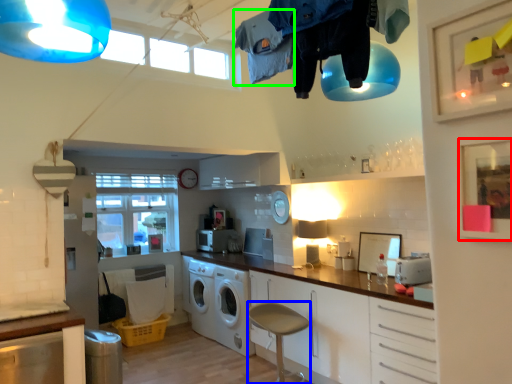
Question: Which is farther away from picture frame (highlighted by a red box)? bar stool (highlighted by a blue box) or clothing (highlighted by a green box)?

Choices:
 (A) bar stool
 (B) clothing

Answer: (A)